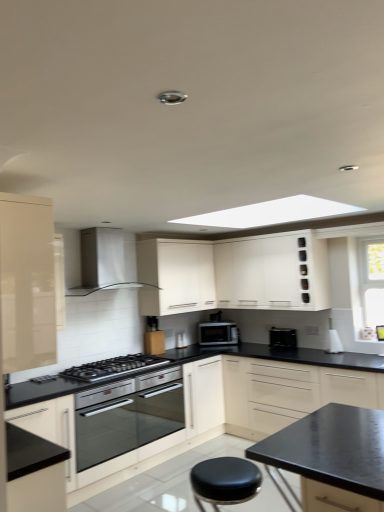
This screenshot has height=512, width=384. Describe the element at coordinates (176, 276) in the screenshot. I see `white matte cabinet at center, which is the first cabinetry from back to front` at that location.

At what (x,y) coordinates should I click in order to perform the action: click on stainless steel oven at center. Please return your answer as a coordinate pair (x, y). Image resolution: width=384 pixels, height=512 pixels. Looking at the image, I should click on (128, 416).

Find the location of a particular element. white matte cabinet at upper center, which is the 3th cabinetry from front to back is located at coordinates (266, 273).

What are the coordinates of `black leather stool at lower center` in the screenshot? It's located at (225, 481).

The width and height of the screenshot is (384, 512). I want to click on black matte toaster at lower center, so click(283, 337).

Is satin silver range hood at upper center touching black glass gas stove at center?

They are not placed beside each other.

Between satin silver range hood at upper center and black glass gas stove at center, which one is positioned behind?

satin silver range hood at upper center is further away from the camera.

Is satin silver range hood at upper center taller or shorter than black glass gas stove at center?

satin silver range hood at upper center is taller than black glass gas stove at center.

Considering the sizes of satin silver range hood at upper center and black glass gas stove at center in the image, is satin silver range hood at upper center bigger or smaller than black glass gas stove at center?

In the image, satin silver range hood at upper center appears to be larger than black glass gas stove at center.

From the image's perspective, is satin silver microwave at center above or below black matte toaster at lower center?

Based on their image positions, satin silver microwave at center is located beneath black matte toaster at lower center.

Considering the sizes of objects satin silver microwave at center and black matte toaster at lower center in the image provided, who is wider, satin silver microwave at center or black matte toaster at lower center?

Wider between the two is satin silver microwave at center.

From a real-world perspective, does satin silver microwave at center sit lower than black matte toaster at lower center?

No.

Does satin silver microwave at center have a smaller size compared to black matte toaster at lower center?

No, satin silver microwave at center is not smaller than black matte toaster at lower center.

From a real-world perspective, is black matte toaster at lower center above or below glossy beige cabinet at left, which is counted as the first cabinetry, starting from the front?

From a real-world perspective, black matte toaster at lower center is physically below glossy beige cabinet at left, which is counted as the first cabinetry, starting from the front.

Which of these two, black matte toaster at lower center or glossy beige cabinet at left, which is the 4th cabinetry in back-to-front order, is wider?

glossy beige cabinet at left, which is the 4th cabinetry in back-to-front order, is wider.

Is black matte toaster at lower center to the right of glossy beige cabinet at left, which is counted as the first cabinetry, starting from the front, from the viewer's perspective?

Indeed, black matte toaster at lower center is positioned on the right side of glossy beige cabinet at left, which is counted as the first cabinetry, starting from the front.

Is glossy beige cabinet at left, which is the 4th cabinetry in back-to-front order, located within black matte toaster at lower center?

Definitely not — glossy beige cabinet at left, which is the 4th cabinetry in back-to-front order, is not inside black matte toaster at lower center.

Is point (155, 252) closer or farther from the camera than point (300, 400)?

Point (155, 252) appears to be farther away from the viewer than point (300, 400).

Relative to matte cream cabinet at center, acting as the third cabinetry starting from the back, is white matte cabinet at center, placed as the 4th cabinetry when sorted from front to back, in front or behind?

Visually, white matte cabinet at center, placed as the 4th cabinetry when sorted from front to back, is located behind matte cream cabinet at center, acting as the third cabinetry starting from the back.

From the image's perspective, is white matte cabinet at center, placed as the 4th cabinetry when sorted from front to back, above matte cream cabinet at center, marked as the 2th cabinetry in a front-to-back arrangement?

Correct, white matte cabinet at center, placed as the 4th cabinetry when sorted from front to back, appears higher than matte cream cabinet at center, marked as the 2th cabinetry in a front-to-back arrangement, in the image.

Is white matte cabinet at center, which is the first cabinetry from back to front, aimed at matte cream cabinet at center, marked as the 2th cabinetry in a front-to-back arrangement?

No.

From a real-world perspective, is white matte cabinet at center, placed as the 4th cabinetry when sorted from front to back, below satin silver range hood at upper center?

Yes.

Considering the sizes of white matte cabinet at center, placed as the 4th cabinetry when sorted from front to back, and satin silver range hood at upper center in the image, is white matte cabinet at center, placed as the 4th cabinetry when sorted from front to back, wider or thinner than satin silver range hood at upper center?

Clearly, white matte cabinet at center, placed as the 4th cabinetry when sorted from front to back, has less width compared to satin silver range hood at upper center.

Is black glass gas stove at center next to white matte cabinet at center, which is the first cabinetry from back to front?

No, black glass gas stove at center is not in contact with white matte cabinet at center, which is the first cabinetry from back to front.

Who is shorter, black glass gas stove at center or white matte cabinet at center, placed as the 4th cabinetry when sorted from front to back?

black glass gas stove at center is shorter.

Is black glass gas stove at center to the left or to the right of white matte cabinet at center, which is the first cabinetry from back to front, in the image?

Clearly, black glass gas stove at center is on the left of white matte cabinet at center, which is the first cabinetry from back to front, in the image.

From the image's perspective, which is below, black glass gas stove at center or white matte cabinet at center, placed as the 4th cabinetry when sorted from front to back?

black glass gas stove at center appears lower in the image.

Looking at this image, is black leather stool at lower center beside black glass gas stove at center?

No, black leather stool at lower center is not next to black glass gas stove at center.

Which is closer, (252,479) or (120,358)?

Point (252,479) appears to be closer to the viewer than point (120,358).

Considering the sizes of black leather stool at lower center and black glass gas stove at center in the image, is black leather stool at lower center taller or shorter than black glass gas stove at center?

Clearly, black leather stool at lower center is taller compared to black glass gas stove at center.

The height and width of the screenshot is (512, 384). Identify the location of gas stove lying below the satin silver range hood at upper center (from the image's perspective). point(114,368).

You are a GUI agent. You are given a task and a screenshot of the screen. Output one action in this format:
    pyautogui.click(x=<x>, y=<y>)
    Task: Click on the appliance located underneath the satin silver microwave at center (from a real-world perspective)
    The height and width of the screenshot is (512, 384).
    Given the screenshot: What is the action you would take?
    pyautogui.click(x=283, y=337)

When comparing their distances from satin silver microwave at center, does black matte toaster at lower center or matte cream cabinet at center, acting as the third cabinetry starting from the back, seem closer?

Among the two, black matte toaster at lower center is located nearer to satin silver microwave at center.

From the image, which object appears to be nearer to black leather stool at lower center, satin silver microwave at center or white matte cabinet at center, placed as the 4th cabinetry when sorted from front to back?

white matte cabinet at center, placed as the 4th cabinetry when sorted from front to back.

Considering their positions, is matte cream cabinet at center, marked as the 2th cabinetry in a front-to-back arrangement, positioned closer to satin silver microwave at center than white matte cabinet at upper center, arranged as the second cabinetry when viewed from the back?

white matte cabinet at upper center, arranged as the second cabinetry when viewed from the back, is positioned closer to the anchor satin silver microwave at center.

Based on their spatial positions, is matte cream cabinet at center, marked as the 2th cabinetry in a front-to-back arrangement, or glossy beige cabinet at left, which is counted as the first cabinetry, starting from the front, closer to satin silver microwave at center?

Among the two, matte cream cabinet at center, marked as the 2th cabinetry in a front-to-back arrangement, is located nearer to satin silver microwave at center.

Estimate the real-world distances between objects in this image. Which object is closer to glossy beige cabinet at left, which is the 4th cabinetry in back-to-front order, white matte cabinet at center, placed as the 4th cabinetry when sorted from front to back, or satin silver microwave at center?

white matte cabinet at center, placed as the 4th cabinetry when sorted from front to back, is closer to glossy beige cabinet at left, which is the 4th cabinetry in back-to-front order.

Looking at this image, from the image, which object appears to be farther from white matte cabinet at upper center, which is the 3th cabinetry from front to back, satin silver microwave at center or white matte cabinet at center, placed as the 4th cabinetry when sorted from front to back?

satin silver microwave at center is further to white matte cabinet at upper center, which is the 3th cabinetry from front to back.

Based on their spatial positions, is satin silver range hood at upper center or matte cream cabinet at center, acting as the third cabinetry starting from the back, further from white matte cabinet at center, placed as the 4th cabinetry when sorted from front to back?

Based on the image, matte cream cabinet at center, acting as the third cabinetry starting from the back, appears to be further to white matte cabinet at center, placed as the 4th cabinetry when sorted from front to back.

Looking at the image, which one is located closer to white matte cabinet at center, which is the first cabinetry from back to front, white matte cabinet at upper center, which is the 3th cabinetry from front to back, or black leather stool at lower center?

Among the two, white matte cabinet at upper center, which is the 3th cabinetry from front to back, is located nearer to white matte cabinet at center, which is the first cabinetry from back to front.

You are a GUI agent. You are given a task and a screenshot of the screen. Output one action in this format:
    pyautogui.click(x=<x>, y=<y>)
    Task: Click on the stool between glossy beige cabinet at left, which is the 4th cabinetry in back-to-front order, and black glass gas stove at center, along the z-axis
    The height and width of the screenshot is (512, 384).
    Given the screenshot: What is the action you would take?
    pyautogui.click(x=225, y=481)

Where is `oven positioned between black leather stool at lower center and black matte toaster at lower center from near to far`? This screenshot has width=384, height=512. oven positioned between black leather stool at lower center and black matte toaster at lower center from near to far is located at coordinates (128, 416).

In order to click on gas stove between glossy beige cabinet at left, which is the 4th cabinetry in back-to-front order, and stainless steel oven at center, along the z-axis in this screenshot , I will do `click(114, 368)`.

Where is `oven between black glass gas stove at center and white matte cabinet at upper center, arranged as the second cabinetry when viewed from the back, from left to right`? The image size is (384, 512). oven between black glass gas stove at center and white matte cabinet at upper center, arranged as the second cabinetry when viewed from the back, from left to right is located at coordinates (128, 416).